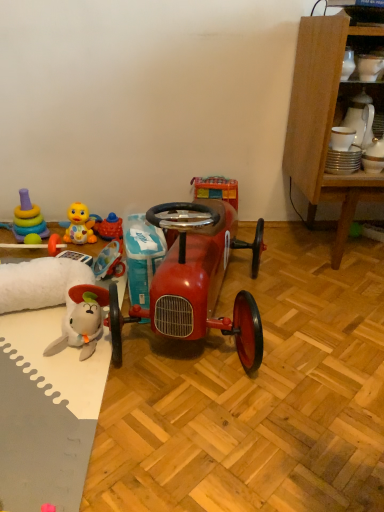
Question: Is wooden cabinet at right not near rubber duck at lower left, acting as the 4th toy starting from the right?

Choices:
 (A) no
 (B) yes

Answer: (B)

Question: Does wooden cabinet at right have a greater width compared to rubber duck at lower left, the second toy in the left-to-right sequence?

Choices:
 (A) no
 (B) yes

Answer: (B)

Question: Is wooden cabinet at right with rubber duck at lower left, the second toy in the left-to-right sequence?

Choices:
 (A) yes
 (B) no

Answer: (B)

Question: Could rubber duck at lower left, the second toy in the left-to-right sequence, be considered to be inside wooden cabinet at right?

Choices:
 (A) yes
 (B) no

Answer: (B)

Question: Considering the relative sizes of wooden cabinet at right and rubber duck at lower left, acting as the 4th toy starting from the right, in the image provided, is wooden cabinet at right bigger than rubber duck at lower left, acting as the 4th toy starting from the right,?

Choices:
 (A) yes
 (B) no

Answer: (A)

Question: From the image's perspective, is stacked plastic rings at left, placed as the first toy when sorted from left to right, located above or below wooden cabinet at right?

Choices:
 (A) below
 (B) above

Answer: (A)

Question: Considering the positions of stacked plastic rings at left, which ranks as the 5th toy in right-to-left order, and wooden cabinet at right in the image, is stacked plastic rings at left, which ranks as the 5th toy in right-to-left order, wider or thinner than wooden cabinet at right?

Choices:
 (A) wide
 (B) thin

Answer: (B)

Question: From a real-world perspective, is stacked plastic rings at left, placed as the first toy when sorted from left to right, positioned above or below wooden cabinet at right?

Choices:
 (A) below
 (B) above

Answer: (A)

Question: Considering their positions, is stacked plastic rings at left, which ranks as the 5th toy in right-to-left order, located in front of or behind wooden cabinet at right?

Choices:
 (A) behind
 (B) front

Answer: (A)

Question: Is stacked plastic rings at left, which ranks as the 5th toy in right-to-left order, to the left or to the right of rubber duck at left, acting as the 2th toy starting from the right, in the image?

Choices:
 (A) left
 (B) right

Answer: (A)

Question: From the image's perspective, relative to rubber duck at left, acting as the 2th toy starting from the right, is stacked plastic rings at left, which ranks as the 5th toy in right-to-left order, above or below?

Choices:
 (A) above
 (B) below

Answer: (A)

Question: In terms of width, does stacked plastic rings at left, placed as the first toy when sorted from left to right, look wider or thinner when compared to rubber duck at left, which is the 4th toy from left to right?

Choices:
 (A) wide
 (B) thin

Answer: (A)

Question: Looking at the image, does stacked plastic rings at left, which ranks as the 5th toy in right-to-left order, seem bigger or smaller compared to rubber duck at left, acting as the 2th toy starting from the right?

Choices:
 (A) small
 (B) big

Answer: (B)

Question: From a real-world perspective, is rubber duck at left, acting as the 2th toy starting from the right, physically located above or below wooden cabinet at right?

Choices:
 (A) below
 (B) above

Answer: (A)

Question: Relative to wooden cabinet at right, is rubber duck at left, acting as the 2th toy starting from the right, in front or behind?

Choices:
 (A) front
 (B) behind

Answer: (B)